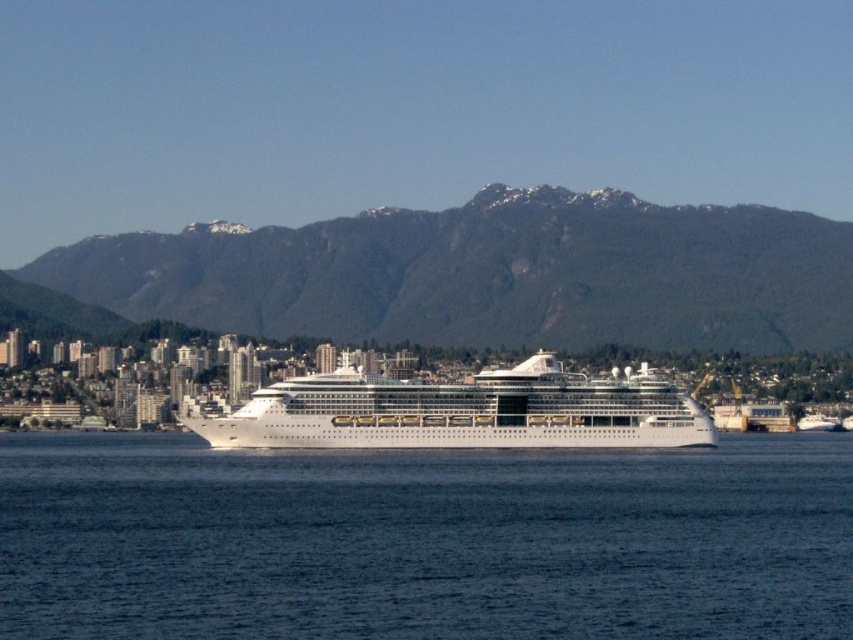
Can you confirm if blue water at center is smaller than white glossy cruise ship at center?

Correct, blue water at center occupies less space than white glossy cruise ship at center.

Who is more distant from viewer, (657, 563) or (312, 417)?

Point (312, 417)

Measure the distance between point (552, 548) and camera.

Point (552, 548) is 169.09 meters from camera.

This screenshot has width=853, height=640. What are the coordinates of `blue water at center` in the screenshot? It's located at (422, 541).

Does blue water at center come behind green textured mountain at center?

No, it is in front of green textured mountain at center.

Does blue water at center appear over green textured mountain at center?

Incorrect, blue water at center is not positioned above green textured mountain at center.

Is point (45, 483) positioned in front of point (251, 308)?

Yes, point (45, 483) is in front of point (251, 308).

In order to click on blue water at center in this screenshot , I will do `click(422, 541)`.

Who is higher up, green textured mountain at center or white glossy cruise ship at center?

green textured mountain at center is above.

Does green textured mountain at center appear on the left side of white glossy cruise ship at center?

No, green textured mountain at center is not to the left of white glossy cruise ship at center.

Measure the distance between green textured mountain at center and camera.

green textured mountain at center and camera are 575.81 meters apart.

You are a GUI agent. You are given a task and a screenshot of the screen. Output one action in this format:
    pyautogui.click(x=<x>, y=<y>)
    Task: Click on the green textured mountain at center
    
    Given the screenshot: What is the action you would take?
    pyautogui.click(x=491, y=275)